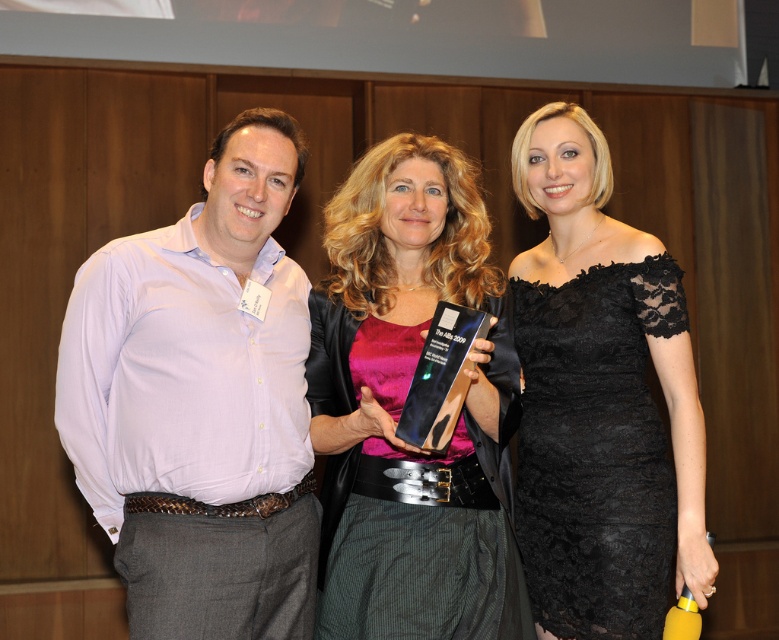
Can you confirm if linen shirt at left is bigger than pink velvet dress at center?

Incorrect, linen shirt at left is not larger than pink velvet dress at center.

Can you confirm if linen shirt at left is wider than pink velvet dress at center?

Yes.

Who is more distant from viewer, [210,404] or [386,189]?

Positioned behind is point [386,189].

At what (x,y) coordinates should I click in order to perform the action: click on linen shirt at left. Please return your answer as a coordinate pair (x, y). Looking at the image, I should click on (201, 403).

Is point (252, 531) positioned before point (696, 538)?

Yes, point (252, 531) is in front of point (696, 538).

Where is `linen shirt at left`? This screenshot has width=779, height=640. linen shirt at left is located at coordinates click(x=201, y=403).

What do you see at coordinates (402, 404) in the screenshot?
I see `pink velvet dress at center` at bounding box center [402, 404].

Is point (330, 500) positioned in front of point (583, 218)?

That is True.

Image resolution: width=779 pixels, height=640 pixels. What do you see at coordinates (402, 404) in the screenshot?
I see `pink velvet dress at center` at bounding box center [402, 404].

Find the location of a particular element. pink velvet dress at center is located at coordinates (402, 404).